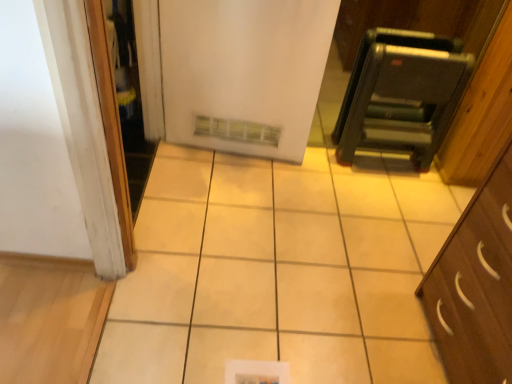
Find the location of a particular element. free space underneath white glossy screen door at left (from a real-world perspective) is located at coordinates (137, 173).